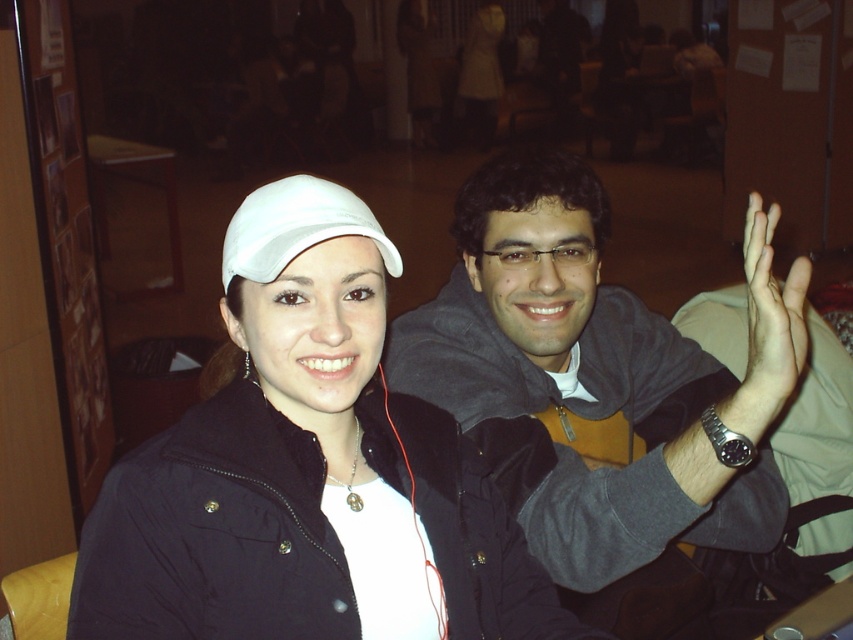
Question: Which object appears closest to the camera in this image?

Choices:
 (A) matte skin hand at upper right
 (B) white matte cap at upper left

Answer: (B)

Question: Is white matte cap at center to the right of matte skin hand at upper right from the viewer's perspective?

Choices:
 (A) no
 (B) yes

Answer: (A)

Question: Estimate the real-world distances between objects in this image. Which object is closer to the white matte cap at upper left?

Choices:
 (A) matte skin hand at upper right
 (B) matte gray hoodie at center
 (C) white matte cap at center

Answer: (C)

Question: Does white matte cap at center appear under matte skin hand at upper right?

Choices:
 (A) yes
 (B) no

Answer: (B)

Question: Which point appears farthest from the camera in this image?

Choices:
 (A) (460, 620)
 (B) (323, 224)
 (C) (459, 289)

Answer: (C)

Question: Can you confirm if white matte cap at upper left is bigger than white matte cap at center?

Choices:
 (A) yes
 (B) no

Answer: (A)